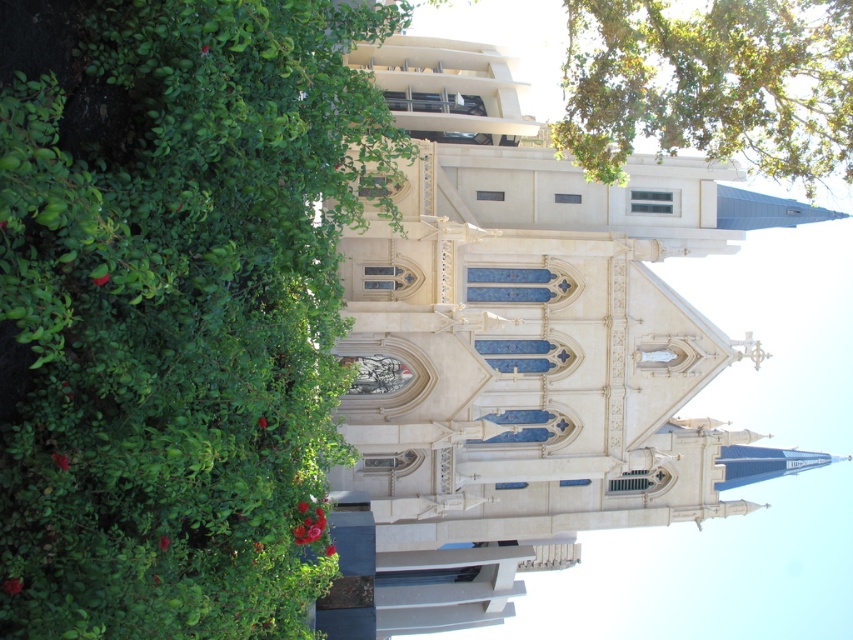
You are standing in front of the white stone church steeple at center and want to take a photo of the green leafy bush at left. Which object should you focus on first to ensure both are in the frame?

You should focus on the green leafy bush at left first because it is closer to the viewer than the white stone church steeple at center, ensuring both are in focus.

You are standing in front of the church and want to walk from the green leafy bush at left to the green leafy tree at upper right. Which direction should you move?

You should move to the right to go from the green leafy bush at left to the green leafy tree at upper right since the bush is to the left of the tree.